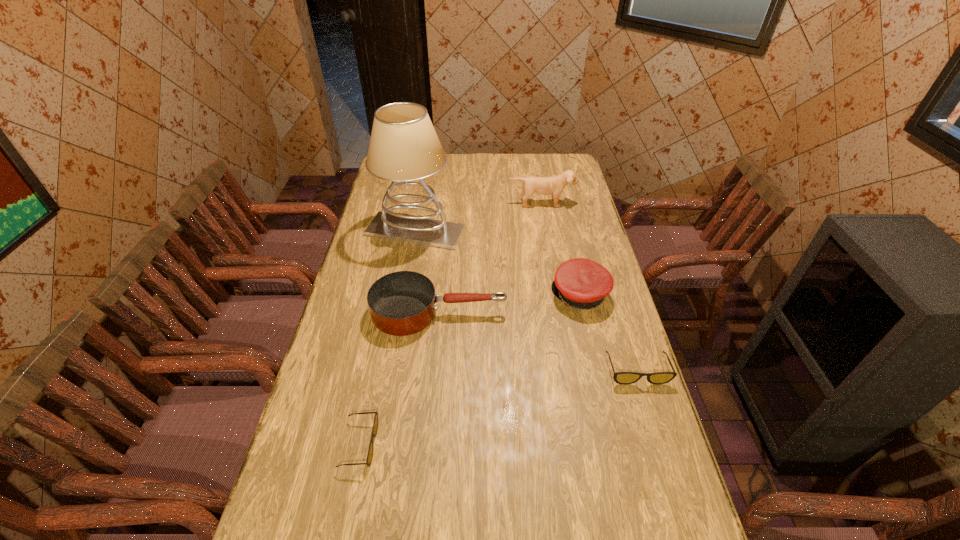
The width and height of the screenshot is (960, 540). In order to click on the nearer sunglasses in this screenshot , I will do `click(375, 425)`.

Locate an element on the screen. the shortest object is located at coordinates (375, 425).

At what (x,y) coordinates should I click in order to perform the action: click on the second nearest object. Please return your answer as a coordinate pair (x, y). Looking at the image, I should click on (x=625, y=378).

I want to click on the farther sunglasses, so [x=625, y=378].

Locate an element on the screen. The height and width of the screenshot is (540, 960). the tallest object is located at coordinates (404, 146).

Locate an element on the screen. the fifth nearest object is located at coordinates (404, 146).

Find the location of a particular element. The height and width of the screenshot is (540, 960). pan is located at coordinates (402, 303).

The height and width of the screenshot is (540, 960). Identify the location of the farthest object. (554, 185).

Locate an element on the screen. the fifth shortest object is located at coordinates tap(554, 185).

Where is `cap`? cap is located at coordinates (581, 283).